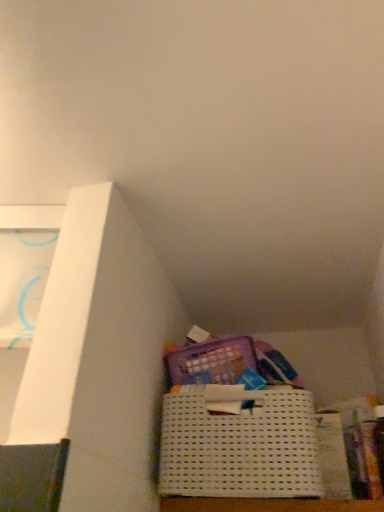
Where is `white woven basket at lower center`? The image size is (384, 512). white woven basket at lower center is located at coordinates (239, 445).

The width and height of the screenshot is (384, 512). Describe the element at coordinates (239, 445) in the screenshot. I see `white woven basket at lower center` at that location.

This screenshot has width=384, height=512. What are the coordinates of `white paper at lower right` in the screenshot? It's located at (332, 456).

What do you see at coordinates (332, 456) in the screenshot? The image size is (384, 512). I see `white paper at lower right` at bounding box center [332, 456].

Find the location of a particular element. This screenshot has height=512, width=384. white woven basket at lower center is located at coordinates (239, 445).

Is white paper at lower right to the left of white woven basket at lower center from the viewer's perspective?

Incorrect, white paper at lower right is not on the left side of white woven basket at lower center.

Which object is further away from the camera taking this photo, white paper at lower right or white woven basket at lower center?

white paper at lower right is more distant.

Is point (339, 449) positioned after point (173, 438)?

Yes, it is.

From the image's perspective, which one is positioned higher, white paper at lower right or white woven basket at lower center?

white woven basket at lower center appears higher in the image.

From a real-world perspective, does white paper at lower right stand above white woven basket at lower center?

No.

Considering the sizes of objects white paper at lower right and white woven basket at lower center in the image provided, who is wider, white paper at lower right or white woven basket at lower center?

Wider between the two is white woven basket at lower center.

Between white paper at lower right and white woven basket at lower center, which one has more height?

white paper at lower right.

Can you confirm if white paper at lower right is smaller than white woven basket at lower center?

Correct, white paper at lower right occupies less space than white woven basket at lower center.

From the picture: Choose the correct answer: Is white paper at lower right inside white woven basket at lower center or outside it?

white paper at lower right cannot be found inside white woven basket at lower center.

Is there a large distance between white paper at lower right and white woven basket at lower center?

white paper at lower right is actually quite close to white woven basket at lower center.

Is white paper at lower right oriented towards white woven basket at lower center?

No, white paper at lower right does not turn towards white woven basket at lower center.

How many degrees apart are the facing directions of white paper at lower right and white woven basket at lower center?

There is a 0.000734-degree angle between the facing directions of white paper at lower right and white woven basket at lower center.

At what (x,y) coordinates should I click in order to perform the action: click on basket above the white paper at lower right (from the image's perspective). Please return your answer as a coordinate pair (x, y). Looking at the image, I should click on (239, 445).

Considering the relative positions of white woven basket at lower center and white paper at lower right in the image provided, is white woven basket at lower center to the right of white paper at lower right from the viewer's perspective?

In fact, white woven basket at lower center is to the left of white paper at lower right.

Which object is further away from the camera, white woven basket at lower center or white paper at lower right?

white paper at lower right is further away from the camera.

Which is less distant, (293, 441) or (338, 420)?

Point (293, 441) appears to be closer to the viewer than point (338, 420).

Looking at this image, from the image's perspective, which object appears higher, white woven basket at lower center or white paper at lower right?

white woven basket at lower center appears higher in the image.

From a real-world perspective, is white woven basket at lower center above or below white paper at lower right?

In terms of real-world spatial position, white woven basket at lower center is above white paper at lower right.

Is white woven basket at lower center thinner than white paper at lower right?

Incorrect, the width of white woven basket at lower center is not less than that of white paper at lower right.

In terms of height, does white woven basket at lower center look taller or shorter compared to white paper at lower right?

In the image, white woven basket at lower center appears to be shorter than white paper at lower right.

In terms of size, does white woven basket at lower center appear bigger or smaller than white paper at lower right?

white woven basket at lower center is bigger than white paper at lower right.

In the scene shown: Is white paper at lower right surrounded by white woven basket at lower center?

No, white paper at lower right is not inside white woven basket at lower center.

Is the surface of white woven basket at lower center in direct contact with white paper at lower right?

white woven basket at lower center and white paper at lower right are not in contact.

Does white woven basket at lower center turn towards white paper at lower right?

Result: No, white woven basket at lower center is not oriented towards white paper at lower right.

What's the angular difference between white woven basket at lower center and white paper at lower right's facing directions?

There is a 0.000734-degree angle between the facing directions of white woven basket at lower center and white paper at lower right.

How far apart are white woven basket at lower center and white paper at lower right?

white woven basket at lower center is 5.79 inches away from white paper at lower right.

Image resolution: width=384 pixels, height=512 pixels. I want to click on paperback book located below the white woven basket at lower center (from the image's perspective), so [x=332, y=456].

What are the coordinates of `paperback book below the white woven basket at lower center (from a real-world perspective)` in the screenshot? It's located at (332, 456).

Where is `paperback book behind the white woven basket at lower center`? The width and height of the screenshot is (384, 512). paperback book behind the white woven basket at lower center is located at coordinates (332, 456).